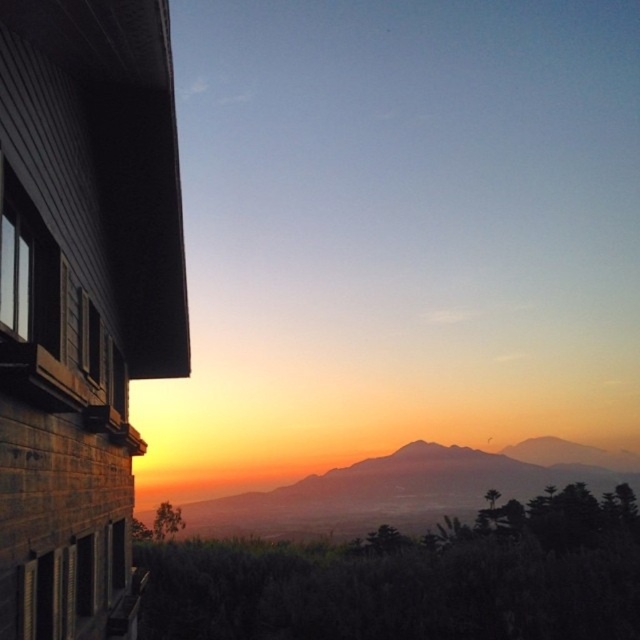
Question: Which of the following is the farthest from the observer?

Choices:
 (A) (68, 305)
 (B) (428, 468)

Answer: (B)

Question: Is orange-hued mountain range at center wider than matte wood window at left?

Choices:
 (A) yes
 (B) no

Answer: (A)

Question: Can you confirm if orange-hued mountain range at center is bigger than matte wood window at left?

Choices:
 (A) yes
 (B) no

Answer: (A)

Question: Among these points, which one is nearest to the camera?

Choices:
 (A) (360, 492)
 (B) (51, 349)

Answer: (B)

Question: Which object is closer to the camera taking this photo?

Choices:
 (A) matte wood window at left
 (B) orange-hued mountain range at center

Answer: (A)

Question: Is orange-hued mountain range at center in front of matte wood window at left?

Choices:
 (A) yes
 (B) no

Answer: (B)